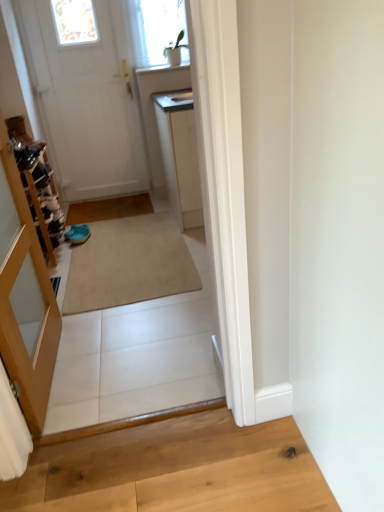
Question: Is white matte door at upper left inside the boundaries of beige carpet at center, or outside?

Choices:
 (A) inside
 (B) outside

Answer: (B)

Question: From the image's perspective, is white matte door at upper left located above or below beige carpet at center?

Choices:
 (A) below
 (B) above

Answer: (B)

Question: Which is nearer to the light brown wood at lower right?

Choices:
 (A) white matte door at upper left
 (B) beige carpet at center

Answer: (B)

Question: Considering the real-world distances, which object is closest to the light brown wood at lower right?

Choices:
 (A) white matte door at upper left
 (B) beige carpet at center

Answer: (B)